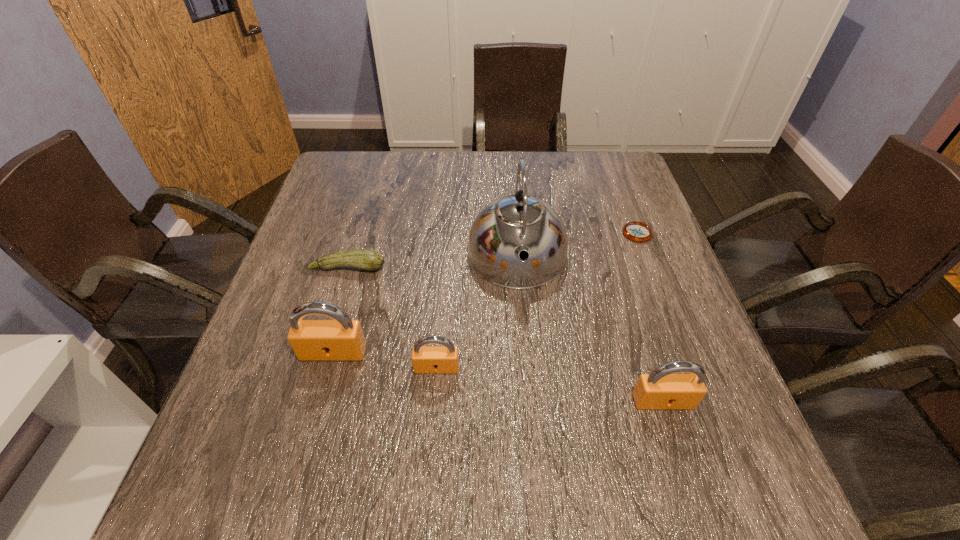
You are a GUI agent. You are given a task and a screenshot of the screen. Output one action in this format:
    pyautogui.click(x=<x>, y=<y>)
    Task: Click on the tallest padlock
    
    Given the screenshot: What is the action you would take?
    pyautogui.click(x=342, y=339)

At what (x,y) coordinates should I click in order to perform the action: click on the second tallest object. Please return your answer as a coordinate pair (x, y). The height and width of the screenshot is (540, 960). Looking at the image, I should click on point(342,339).

Identify the location of the shortest padlock. (444, 359).

Identify the location of the second padlock from left to right. This screenshot has width=960, height=540. (444, 359).

This screenshot has width=960, height=540. In order to click on the second tallest padlock in this screenshot , I will do `click(661, 389)`.

At what (x,y) coordinates should I click in order to perform the action: click on the rightmost padlock. Please return your answer as a coordinate pair (x, y). The height and width of the screenshot is (540, 960). Looking at the image, I should click on (661, 389).

Locate an element on the screen. The image size is (960, 540). kettle is located at coordinates (511, 226).

Find the location of a particular element. The width and height of the screenshot is (960, 540). the third object from right to left is located at coordinates (511, 226).

The height and width of the screenshot is (540, 960). What are the coordinates of `the fifth tallest object` in the screenshot? It's located at (366, 259).

Identify the location of the shortest object. (636, 231).